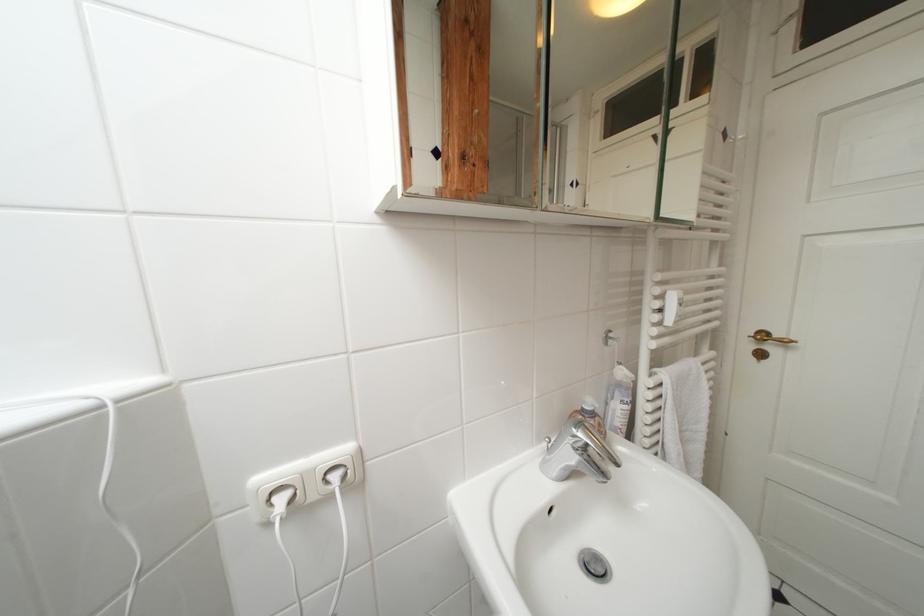
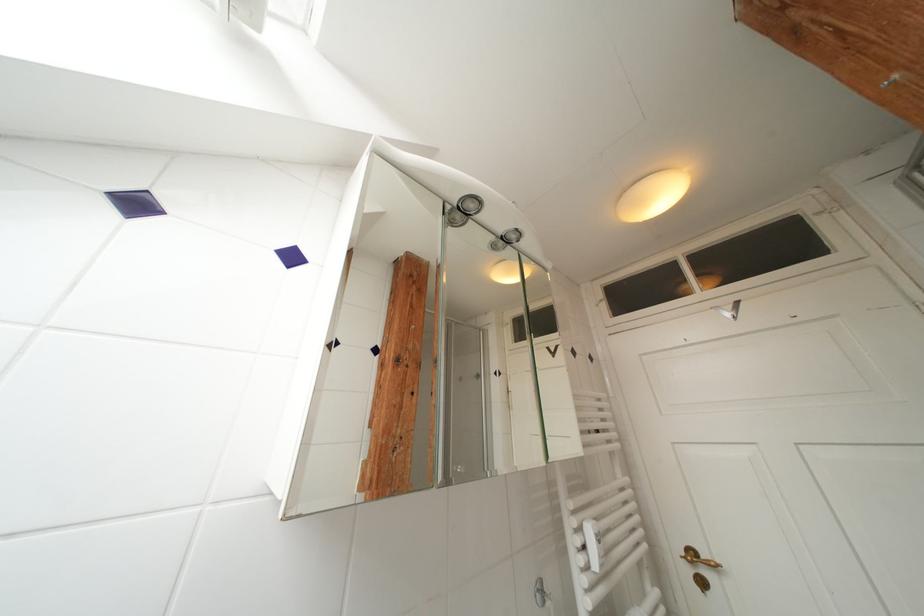
Where in the second image is the point corresponding to (x=667, y=300) from the first image?

(586, 533)